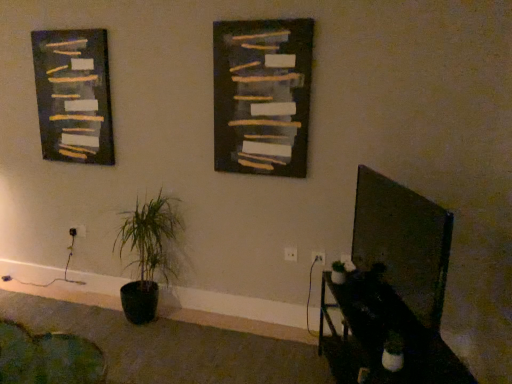
Question: Which direction should I rotate to look at white plastic electric outlet at lower center, arranged as the first electric outlet when viewed from the front, — up or down?

Choices:
 (A) down
 (B) up

Answer: (A)

Question: Does dark gray textured painting at left lie behind dark matte board at center?

Choices:
 (A) no
 (B) yes

Answer: (B)

Question: Considering the relative sizes of dark gray textured painting at left and dark matte board at center in the image provided, is dark gray textured painting at left smaller than dark matte board at center?

Choices:
 (A) no
 (B) yes

Answer: (A)

Question: Is dark gray textured painting at left positioned beyond the bounds of dark matte board at center?

Choices:
 (A) no
 (B) yes

Answer: (B)

Question: Does dark gray textured painting at left have a greater height compared to dark matte board at center?

Choices:
 (A) yes
 (B) no

Answer: (A)

Question: From a real-world perspective, is dark gray textured painting at left positioned under dark matte board at center based on gravity?

Choices:
 (A) no
 (B) yes

Answer: (B)

Question: Can you confirm if dark gray textured painting at left is bigger than dark matte board at center?

Choices:
 (A) no
 (B) yes

Answer: (B)

Question: From the image's perspective, is black glossy table at lower right above white plastic electric outlet at lower left, the first electric outlet viewed from the left?

Choices:
 (A) no
 (B) yes

Answer: (A)

Question: From the image's perspective, is black glossy table at lower right located beneath white plastic electric outlet at lower left, the first electric outlet viewed from the left?

Choices:
 (A) no
 (B) yes

Answer: (B)

Question: Considering the relative sizes of black glossy table at lower right and white plastic electric outlet at lower left, which is counted as the third electric outlet, starting from the right, in the image provided, is black glossy table at lower right bigger than white plastic electric outlet at lower left, which is counted as the third electric outlet, starting from the right,?

Choices:
 (A) no
 (B) yes

Answer: (B)

Question: Would you say black glossy table at lower right is a long distance from white plastic electric outlet at lower left, the 3th electric outlet viewed from the front?

Choices:
 (A) yes
 (B) no

Answer: (A)

Question: Does black glossy table at lower right have a greater height compared to white plastic electric outlet at lower left, the first electric outlet viewed from the left?

Choices:
 (A) yes
 (B) no

Answer: (A)

Question: Considering the relative positions of black glossy table at lower right and white plastic electric outlet at lower left, which is counted as the third electric outlet, starting from the right, in the image provided, is black glossy table at lower right to the left of white plastic electric outlet at lower left, which is counted as the third electric outlet, starting from the right, from the viewer's perspective?

Choices:
 (A) no
 (B) yes

Answer: (A)

Question: Considering the relative sizes of green matte plant at lower left and dark gray textured painting at left in the image provided, is green matte plant at lower left taller than dark gray textured painting at left?

Choices:
 (A) yes
 (B) no

Answer: (A)